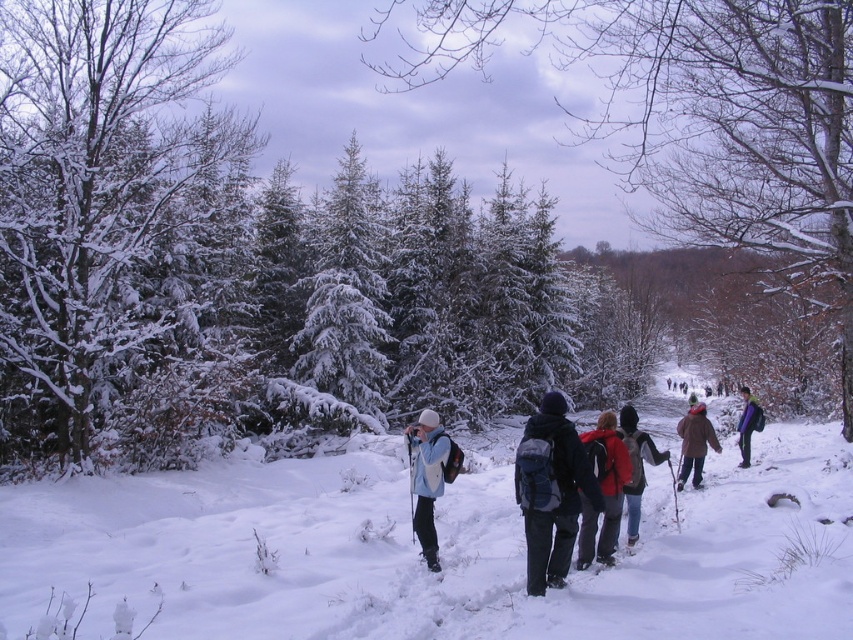
Question: Which object appears farthest from the camera in this image?

Choices:
 (A) denim jacket at center
 (B) white snow-covered tree at left
 (C) white fluffy snow at center
 (D) purple fleece jacket at right

Answer: (D)

Question: Which of the following is the farthest from the observer?

Choices:
 (A) (581, 545)
 (B) (741, 426)

Answer: (B)

Question: Which object is closer to the camera taking this photo?

Choices:
 (A) light blue fabric jacket at center
 (B) denim jacket at center

Answer: (A)

Question: Can you confirm if white fluffy snow at center is positioned to the left of light blue fabric jacket at center?

Choices:
 (A) no
 (B) yes

Answer: (A)

Question: From the image, what is the correct spatial relationship of white snow-covered tree at left in relation to brown fuzzy jacket at center?

Choices:
 (A) below
 (B) above

Answer: (B)

Question: Is dark blue backpack at center below brown fuzzy jacket at center?

Choices:
 (A) no
 (B) yes

Answer: (A)